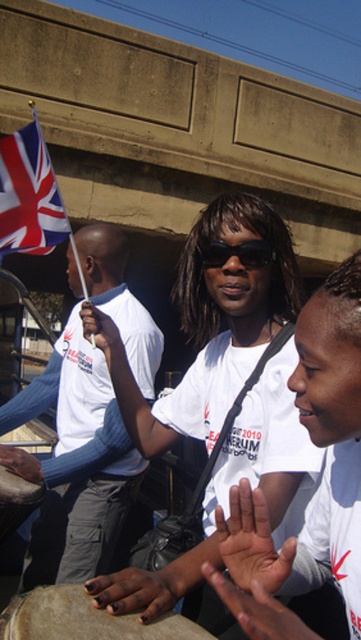
You are a photographer at the event and want to capture a photo where both the smooth skin hand at center and the brushed metal drum at lower left are clearly visible. Given their sizes, which object should you focus on to ensure both are in frame?

The smooth skin hand at center is smaller than the brushed metal drum at lower left, so focusing on the brushed metal drum at lower left will help ensure both are in frame as the drum is larger and central to the scene.

You are a photographer taking a picture of the smooth skin hand at center and the brushed metal drum at lower left. Which object will appear larger in the photo?

The smooth skin hand at center will appear larger in the photo because it is closer to the viewer than the brushed metal drum at lower left.

You are a photographer taking pictures of the union jack fabric at left and the brushed metal drum at lower left. Which object should you focus on first if you want to capture both in one shot without moving the camera?

The union jack fabric at left is above the brushed metal drum at lower left, so you should focus on the union jack fabric at left first to ensure both are in frame.